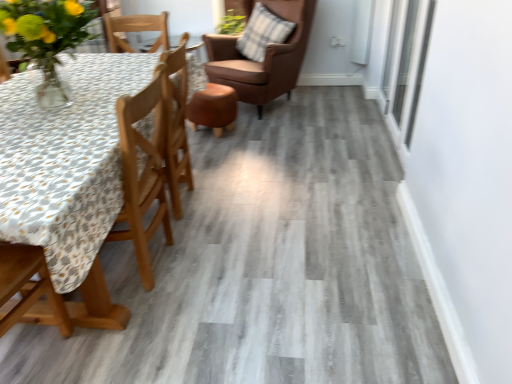
Question: Is point (29, 248) closer or farther from the camera than point (426, 23)?

Choices:
 (A) farther
 (B) closer

Answer: (B)

Question: Visually, is wooden chair at left, the 1th chair ordered from the bottom, positioned to the left or to the right of transparent glass window at upper right?

Choices:
 (A) right
 (B) left

Answer: (B)

Question: Which object is the farthest from the transparent glass window at upper right?

Choices:
 (A) translucent glass vase at upper left
 (B) plaid fabric pillow at upper right
 (C) brown leather chair at upper center, the second chair positioned from the bottom
 (D) wooden chair at left, acting as the 1th chair starting from the front

Answer: (D)

Question: Estimate the real-world distances between objects in this image. Which object is closer to the wooden chair at left, acting as the 1th chair starting from the front?

Choices:
 (A) translucent glass vase at upper left
 (B) brown leather chair at upper center, which ranks as the second chair in front-to-back order
 (C) transparent glass window at upper right
 (D) plaid fabric pillow at upper right

Answer: (A)